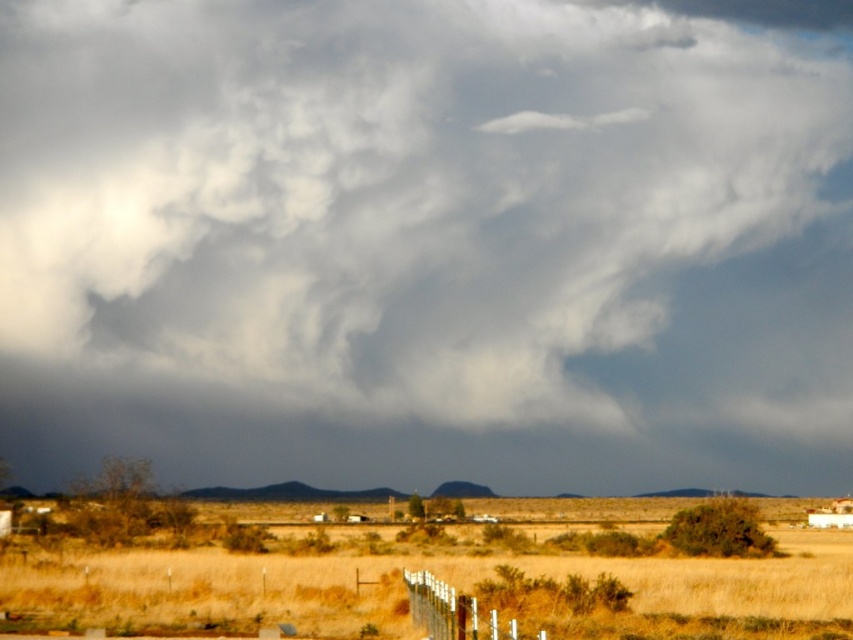
Question: Which of the following is the farthest from the observer?

Choices:
 (A) (334, 545)
 (B) (434, 596)

Answer: (A)

Question: Is dry grass at lower center positioned at the back of white wooden fence at lower center?

Choices:
 (A) no
 (B) yes

Answer: (B)

Question: Is dry grass at lower center to the left of white wooden fence at lower center from the viewer's perspective?

Choices:
 (A) yes
 (B) no

Answer: (A)

Question: Is dry grass at lower center above white wooden fence at lower center?

Choices:
 (A) no
 (B) yes

Answer: (A)

Question: Which object appears closest to the camera in this image?

Choices:
 (A) white wooden fence at lower center
 (B) dry grass at lower center

Answer: (A)